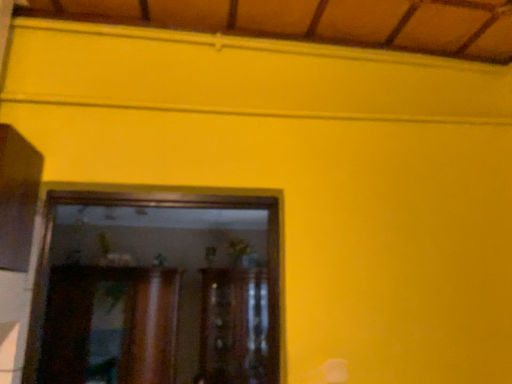
Question: Which direction should I rotate to look at wooden cabinet at center, acting as the 1th cabinetry starting from the right, — up or down?

Choices:
 (A) up
 (B) down

Answer: (B)

Question: In which direction should I rotate to look at wooden cabinet at center, which appears as the 2th cabinetry when viewed from the right?

Choices:
 (A) left
 (B) right

Answer: (A)

Question: Can we say wooden cabinet at center, acting as the 1th cabinetry starting from the right, lies outside wooden cabinet at center, which is counted as the 1th cabinetry, starting from the left?

Choices:
 (A) yes
 (B) no

Answer: (A)

Question: From the image's perspective, is wooden cabinet at center, arranged as the 2th cabinetry when viewed from the left, on top of wooden cabinet at center, which is counted as the 1th cabinetry, starting from the left?

Choices:
 (A) yes
 (B) no

Answer: (B)

Question: Could you tell me if wooden cabinet at center, acting as the 1th cabinetry starting from the right, is turned towards wooden cabinet at center, which is counted as the 1th cabinetry, starting from the left?

Choices:
 (A) no
 (B) yes

Answer: (A)

Question: Considering the relative positions of wooden cabinet at center, acting as the 1th cabinetry starting from the right, and wooden cabinet at center, which is counted as the 1th cabinetry, starting from the left, in the image provided, is wooden cabinet at center, acting as the 1th cabinetry starting from the right, in front of wooden cabinet at center, which is counted as the 1th cabinetry, starting from the left,?

Choices:
 (A) no
 (B) yes

Answer: (A)

Question: Considering the relative sizes of wooden cabinet at center, arranged as the 2th cabinetry when viewed from the left, and wooden cabinet at center, which is counted as the 1th cabinetry, starting from the left, in the image provided, is wooden cabinet at center, arranged as the 2th cabinetry when viewed from the left, smaller than wooden cabinet at center, which is counted as the 1th cabinetry, starting from the left,?

Choices:
 (A) no
 (B) yes

Answer: (A)

Question: Would you say wooden cabinet at center, which appears as the 2th cabinetry when viewed from the right, is part of wooden cabinet at center, arranged as the 2th cabinetry when viewed from the left,'s contents?

Choices:
 (A) no
 (B) yes

Answer: (A)

Question: Is wooden cabinet at center, acting as the 1th cabinetry starting from the right, completely or partially inside wooden cabinet at center, which is counted as the 1th cabinetry, starting from the left?

Choices:
 (A) no
 (B) yes

Answer: (A)

Question: Considering the relative sizes of wooden cabinet at center, which is counted as the 1th cabinetry, starting from the left, and wooden cabinet at center, arranged as the 2th cabinetry when viewed from the left, in the image provided, is wooden cabinet at center, which is counted as the 1th cabinetry, starting from the left, taller than wooden cabinet at center, arranged as the 2th cabinetry when viewed from the left,?

Choices:
 (A) no
 (B) yes

Answer: (A)

Question: Can you confirm if wooden cabinet at center, which appears as the 2th cabinetry when viewed from the right, is wider than wooden cabinet at center, arranged as the 2th cabinetry when viewed from the left?

Choices:
 (A) yes
 (B) no

Answer: (B)

Question: Can you confirm if wooden cabinet at center, which appears as the 2th cabinetry when viewed from the right, is smaller than wooden cabinet at center, acting as the 1th cabinetry starting from the right?

Choices:
 (A) yes
 (B) no

Answer: (A)

Question: Can you confirm if wooden cabinet at center, which appears as the 2th cabinetry when viewed from the right, is positioned to the right of wooden cabinet at center, arranged as the 2th cabinetry when viewed from the left?

Choices:
 (A) no
 (B) yes

Answer: (A)

Question: From the image's perspective, does wooden cabinet at center, which appears as the 2th cabinetry when viewed from the right, appear lower than wooden cabinet at center, acting as the 1th cabinetry starting from the right?

Choices:
 (A) no
 (B) yes

Answer: (A)

Question: Considering the positions of wooden cabinet at center, arranged as the 2th cabinetry when viewed from the left, and wooden cabinet at center, which is counted as the 1th cabinetry, starting from the left, in the image, is wooden cabinet at center, arranged as the 2th cabinetry when viewed from the left, bigger or smaller than wooden cabinet at center, which is counted as the 1th cabinetry, starting from the left,?

Choices:
 (A) small
 (B) big

Answer: (B)